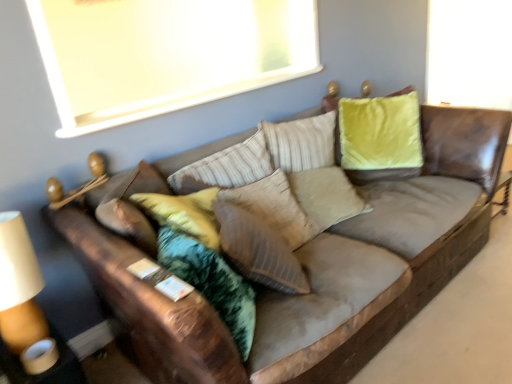
Question: Is point (351, 256) closer or farther from the camera than point (251, 228)?

Choices:
 (A) farther
 (B) closer

Answer: (A)

Question: Considering the relative positions of brown leather couch at center and suede textured pillow at center in the image provided, is brown leather couch at center to the left or to the right of suede textured pillow at center?

Choices:
 (A) right
 (B) left

Answer: (A)

Question: Which object is positioned farthest from the brown leather couch at center?

Choices:
 (A) white matte window screen at upper center
 (B) suede textured pillow at center

Answer: (A)

Question: Estimate the real-world distances between objects in this image. Which object is farther from the suede textured pillow at center?

Choices:
 (A) white matte window screen at upper center
 (B) brown leather couch at center

Answer: (A)